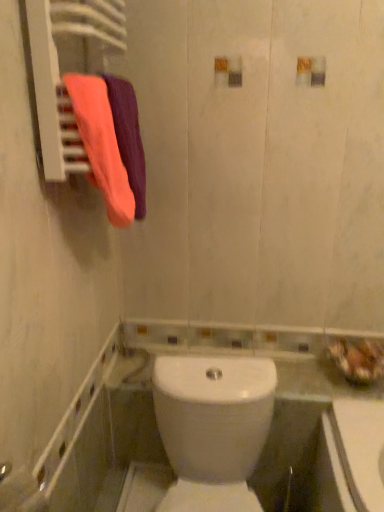
Question: Is white glossy toilet at center completely or partially inside orange cotton towel at upper left, which is counted as the 1th bath towel, starting from the back?

Choices:
 (A) no
 (B) yes

Answer: (A)

Question: Could you tell me if orange cotton towel at upper left, which is counted as the 1th bath towel, starting from the back, is facing white glossy toilet at center?

Choices:
 (A) no
 (B) yes

Answer: (A)

Question: Is orange cotton towel at upper left, the second bath towel positioned from the front, taller than white glossy toilet at center?

Choices:
 (A) yes
 (B) no

Answer: (B)

Question: Does orange cotton towel at upper left, the second bath towel positioned from the front, have a larger size compared to white glossy toilet at center?

Choices:
 (A) yes
 (B) no

Answer: (B)

Question: From a real-world perspective, is orange cotton towel at upper left, which is counted as the 1th bath towel, starting from the back, physically above white glossy toilet at center?

Choices:
 (A) no
 (B) yes

Answer: (B)

Question: From a real-world perspective, is white glossy toilet at center above or below orange cotton towel at upper left, the second bath towel positioned from the front?

Choices:
 (A) above
 (B) below

Answer: (B)

Question: Considering the positions of white glossy toilet at center and orange cotton towel at upper left, which is counted as the 1th bath towel, starting from the back, in the image, is white glossy toilet at center wider or thinner than orange cotton towel at upper left, which is counted as the 1th bath towel, starting from the back,?

Choices:
 (A) wide
 (B) thin

Answer: (A)

Question: Considering the positions of point (165, 425) and point (139, 158), is point (165, 425) closer or farther from the camera than point (139, 158)?

Choices:
 (A) farther
 (B) closer

Answer: (A)

Question: In the image, is white glossy toilet at center positioned in front of or behind orange cotton towel at upper left, which is counted as the 1th bath towel, starting from the back?

Choices:
 (A) front
 (B) behind

Answer: (A)

Question: Is white glossy toilet at center to the left or to the right of matte pink towel at left, the 2th bath towel from the back, in the image?

Choices:
 (A) right
 (B) left

Answer: (A)

Question: Based on their sizes in the image, would you say white glossy toilet at center is bigger or smaller than matte pink towel at left, the 2th bath towel from the back?

Choices:
 (A) small
 (B) big

Answer: (B)

Question: From a real-world perspective, is white glossy toilet at center physically located above or below matte pink towel at left, the 2th bath towel from the back?

Choices:
 (A) above
 (B) below

Answer: (B)

Question: Does point (167, 433) appear closer or farther from the camera than point (114, 118)?

Choices:
 (A) closer
 (B) farther

Answer: (B)

Question: Relative to matte pink towel at left, the 1th bath towel in the front-to-back sequence, is orange cotton towel at upper left, which is counted as the 1th bath towel, starting from the back, in front or behind?

Choices:
 (A) front
 (B) behind

Answer: (B)

Question: Considering the positions of orange cotton towel at upper left, the second bath towel positioned from the front, and matte pink towel at left, the 1th bath towel in the front-to-back sequence, in the image, is orange cotton towel at upper left, the second bath towel positioned from the front, bigger or smaller than matte pink towel at left, the 1th bath towel in the front-to-back sequence,?

Choices:
 (A) small
 (B) big

Answer: (B)